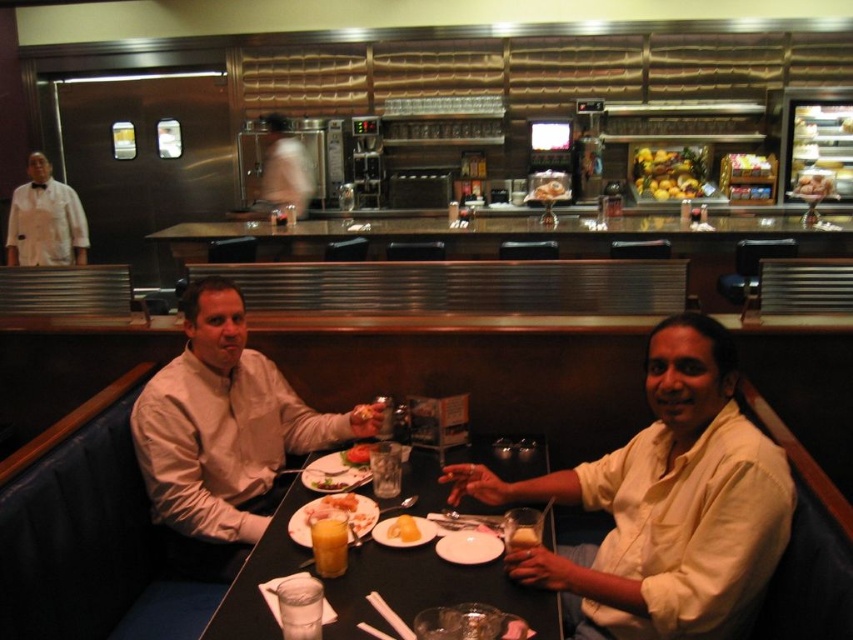
Question: In this image, where is white shirt at center located relative to golden brown bread at right?

Choices:
 (A) below
 (B) above

Answer: (A)

Question: Which is nearer to the shiny golden apples at center?

Choices:
 (A) golden brown bread at lower center
 (B) translucent glass juice at table center
 (C) white cotton shirt at lower right
 (D) white shirt at center

Answer: (D)

Question: Considering the real-world distances, which object is farthest from the matte white plate at center?

Choices:
 (A) translucent glass juice at table center
 (B) yellow creamy dessert at center

Answer: (A)

Question: Can you confirm if white cotton shirt at lower right is positioned to the left of yellow matte bread at center?

Choices:
 (A) no
 (B) yes

Answer: (A)

Question: Can you confirm if shiny golden apples at center is positioned below smooth yellow butter at table center?

Choices:
 (A) no
 (B) yes

Answer: (A)

Question: Estimate the real-world distances between objects in this image. Which object is farther from the white cotton shirt at lower right?

Choices:
 (A) yellow matte bread at center
 (B) smooth yellow butter at table center
 (C) golden brown bread at lower center
 (D) light beige shirt at center

Answer: (B)